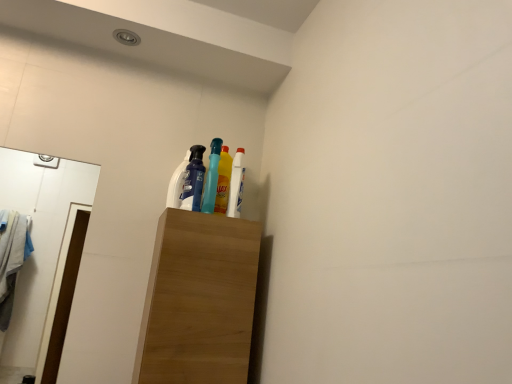
What do you see at coordinates (177, 184) in the screenshot? This screenshot has width=512, height=384. I see `matte white bottle at upper center, which appears as the 2th cleaning product when viewed from the front` at bounding box center [177, 184].

Where is `wooden cabinet at center`? This screenshot has height=384, width=512. wooden cabinet at center is located at coordinates (199, 300).

Is point (212, 142) in front of point (185, 206)?

That is False.

Considering the relative sizes of translucent blue bottle at center, placed as the first bottle when sorted from left to right, and translucent blue bottle at center, acting as the first cleaning product starting from the front, in the image provided, is translucent blue bottle at center, placed as the first bottle when sorted from left to right, wider than translucent blue bottle at center, acting as the first cleaning product starting from the front,?

Correct, the width of translucent blue bottle at center, placed as the first bottle when sorted from left to right, exceeds that of translucent blue bottle at center, acting as the first cleaning product starting from the front.

Is translucent blue bottle at center, which is counted as the second bottle, starting from the right, far from translucent blue bottle at center, the 2th cleaning product positioned from the back?

No, there isn't a large distance between translucent blue bottle at center, which is counted as the second bottle, starting from the right, and translucent blue bottle at center, the 2th cleaning product positioned from the back.

You are a GUI agent. You are given a task and a screenshot of the screen. Output one action in this format:
    pyautogui.click(x=<x>, y=<y>)
    Task: Click on the 1st bottle to the right when counting from the translucent blue bottle at center, acting as the first cleaning product starting from the front
    
    Given the screenshot: What is the action you would take?
    pyautogui.click(x=212, y=177)

Identify the location of cleaning product lying below the translucent blue bottle at center, acting as the first cleaning product starting from the front (from the image's perspective). Image resolution: width=512 pixels, height=384 pixels. 177,184.

Who is more distant, matte white bottle at upper center, which appears as the 2th cleaning product when viewed from the front, or translucent blue bottle at center, acting as the first cleaning product starting from the front?

matte white bottle at upper center, which appears as the 2th cleaning product when viewed from the front, is further from the camera.

From a real-world perspective, is matte white bottle at upper center, which appears as the 2th cleaning product when viewed from the front, on top of translucent blue bottle at center, acting as the first cleaning product starting from the front?

No, from a real-world perspective, matte white bottle at upper center, which appears as the 2th cleaning product when viewed from the front, is not on top of translucent blue bottle at center, acting as the first cleaning product starting from the front.

Is white glossy mirror at left aimed at yellow glossy bottle at upper center, which is the first bottle in right-to-left order?

No, white glossy mirror at left is not aimed at yellow glossy bottle at upper center, which is the first bottle in right-to-left order.

What's the angular difference between white glossy mirror at left and yellow glossy bottle at upper center, which is the first bottle in right-to-left order,'s facing directions?

There is a 2.58-degree angle between the facing directions of white glossy mirror at left and yellow glossy bottle at upper center, which is the first bottle in right-to-left order.

In the image, is white glossy mirror at left positioned in front of or behind yellow glossy bottle at upper center, positioned as the 2th bottle in left-to-right order?

white glossy mirror at left is positioned closer to the viewer than yellow glossy bottle at upper center, positioned as the 2th bottle in left-to-right order.

From a real-world perspective, is white glossy mirror at left on top of yellow glossy bottle at upper center, positioned as the 2th bottle in left-to-right order?

No, from a real-world perspective, white glossy mirror at left is not over yellow glossy bottle at upper center, positioned as the 2th bottle in left-to-right order

What's the angular difference between yellow glossy bottle at upper center, positioned as the 2th bottle in left-to-right order, and wooden cabinet at center's facing directions?

There is a 0.219-degree angle between the facing directions of yellow glossy bottle at upper center, positioned as the 2th bottle in left-to-right order, and wooden cabinet at center.

Which object is thinner, yellow glossy bottle at upper center, positioned as the 2th bottle in left-to-right order, or wooden cabinet at center?

yellow glossy bottle at upper center, positioned as the 2th bottle in left-to-right order, is thinner.

Considering the positions of points (244, 176) and (167, 280), is point (244, 176) farther from camera compared to point (167, 280)?

Yes, it is.

From the image's perspective, is yellow glossy bottle at upper center, which is the first bottle in right-to-left order, on top of wooden cabinet at center?

Yes, from the image's perspective, yellow glossy bottle at upper center, which is the first bottle in right-to-left order, is on top of wooden cabinet at center.

From a real-world perspective, which is physically below, matte white bottle at upper center, which appears as the 2th cleaning product when viewed from the front, or wooden cabinet at center?

In real-world perspective, wooden cabinet at center is lower.

Would you say wooden cabinet at center is part of matte white bottle at upper center, marked as the first cleaning product in a back-to-front arrangement,'s contents?

No, wooden cabinet at center is not surrounded by matte white bottle at upper center, marked as the first cleaning product in a back-to-front arrangement.

This screenshot has height=384, width=512. Find the location of `the 1st cleaning product above the wooden cabinet at center (from a real-world perspective)`. the 1st cleaning product above the wooden cabinet at center (from a real-world perspective) is located at coordinates (177, 184).

Does white glossy mirror at left have a greater height compared to matte white bottle at upper center, which appears as the 2th cleaning product when viewed from the front?

Indeed, white glossy mirror at left has a greater height compared to matte white bottle at upper center, which appears as the 2th cleaning product when viewed from the front.

Where is `mirror on the left side of matte white bottle at upper center, which appears as the 2th cleaning product when viewed from the front`? mirror on the left side of matte white bottle at upper center, which appears as the 2th cleaning product when viewed from the front is located at coordinates (38, 242).

How far apart are white glossy mirror at left and matte white bottle at upper center, which appears as the 2th cleaning product when viewed from the front?

white glossy mirror at left is 1.54 meters from matte white bottle at upper center, which appears as the 2th cleaning product when viewed from the front.

Based on the photo, does white glossy mirror at left appear on the right side of matte white bottle at upper center, which appears as the 2th cleaning product when viewed from the front?

In fact, white glossy mirror at left is to the left of matte white bottle at upper center, which appears as the 2th cleaning product when viewed from the front.

Which of these two, yellow glossy bottle at upper center, positioned as the 2th bottle in left-to-right order, or translucent blue bottle at center, which is counted as the second bottle, starting from the right, is smaller?

yellow glossy bottle at upper center, positioned as the 2th bottle in left-to-right order, is smaller.

Which is in front, yellow glossy bottle at upper center, positioned as the 2th bottle in left-to-right order, or translucent blue bottle at center, placed as the first bottle when sorted from left to right?

Positioned in front is translucent blue bottle at center, placed as the first bottle when sorted from left to right.

Is yellow glossy bottle at upper center, which is the first bottle in right-to-left order, completely or partially outside of translucent blue bottle at center, placed as the first bottle when sorted from left to right?

Yes.

From a real-world perspective, who is located lower, yellow glossy bottle at upper center, positioned as the 2th bottle in left-to-right order, or translucent blue bottle at center, which is counted as the second bottle, starting from the right?

translucent blue bottle at center, which is counted as the second bottle, starting from the right, is physically lower.

The height and width of the screenshot is (384, 512). I want to click on the 1st bottle positioned below the translucent blue bottle at center, the 2th cleaning product positioned from the back (from the image's perspective), so click(212, 177).

Where is `cleaning product lying on the right of matte white bottle at upper center, marked as the first cleaning product in a back-to-front arrangement`? The height and width of the screenshot is (384, 512). cleaning product lying on the right of matte white bottle at upper center, marked as the first cleaning product in a back-to-front arrangement is located at coordinates (194, 180).

When comparing their distances from matte white bottle at upper center, marked as the first cleaning product in a back-to-front arrangement, does white glossy mirror at left or translucent blue bottle at center, acting as the first cleaning product starting from the front, seem closer?

translucent blue bottle at center, acting as the first cleaning product starting from the front, is positioned closer to the anchor matte white bottle at upper center, marked as the first cleaning product in a back-to-front arrangement.

From the image, which object appears to be nearer to matte white bottle at upper center, which appears as the 2th cleaning product when viewed from the front, yellow glossy bottle at upper center, positioned as the 2th bottle in left-to-right order, or wooden cabinet at center?

The object closer to matte white bottle at upper center, which appears as the 2th cleaning product when viewed from the front, is yellow glossy bottle at upper center, positioned as the 2th bottle in left-to-right order.

Considering their positions, is matte white bottle at upper center, marked as the first cleaning product in a back-to-front arrangement, positioned closer to wooden cabinet at center than white glossy mirror at left?

matte white bottle at upper center, marked as the first cleaning product in a back-to-front arrangement, lies closer to wooden cabinet at center than the other object.

When comparing their distances from translucent blue bottle at center, placed as the first bottle when sorted from left to right, does translucent blue bottle at center, the 2th cleaning product positioned from the back, or matte white bottle at upper center, which appears as the 2th cleaning product when viewed from the front, seem further?

matte white bottle at upper center, which appears as the 2th cleaning product when viewed from the front, is further to translucent blue bottle at center, placed as the first bottle when sorted from left to right.

From the image, which object appears to be nearer to matte white bottle at upper center, which appears as the 2th cleaning product when viewed from the front, translucent blue bottle at center, which is counted as the second bottle, starting from the right, or wooden cabinet at center?

translucent blue bottle at center, which is counted as the second bottle, starting from the right, lies closer to matte white bottle at upper center, which appears as the 2th cleaning product when viewed from the front, than the other object.

Estimate the real-world distances between objects in this image. Which object is further from translucent blue bottle at center, the 2th cleaning product positioned from the back, wooden cabinet at center or white glossy mirror at left?

white glossy mirror at left lies further to translucent blue bottle at center, the 2th cleaning product positioned from the back, than the other object.

From the image, which object appears to be farther from matte white bottle at upper center, which appears as the 2th cleaning product when viewed from the front, wooden cabinet at center or translucent blue bottle at center, placed as the first bottle when sorted from left to right?

wooden cabinet at center is positioned further to the anchor matte white bottle at upper center, which appears as the 2th cleaning product when viewed from the front.

Looking at the image, which one is located further to white glossy mirror at left, wooden cabinet at center or yellow glossy bottle at upper center, which is the first bottle in right-to-left order?

wooden cabinet at center is further to white glossy mirror at left.

Identify the location of cleaning product situated between white glossy mirror at left and translucent blue bottle at center, acting as the first cleaning product starting from the front, from left to right. The width and height of the screenshot is (512, 384). (177, 184).

Identify the location of bottle located between white glossy mirror at left and yellow glossy bottle at upper center, which is the first bottle in right-to-left order, in the left-right direction. This screenshot has height=384, width=512. (212, 177).

The image size is (512, 384). What are the coordinates of `cleaning product between translucent blue bottle at center, the 2th cleaning product positioned from the back, and wooden cabinet at center vertically` in the screenshot? It's located at (177, 184).

You are a GUI agent. You are given a task and a screenshot of the screen. Output one action in this format:
    pyautogui.click(x=<x>, y=<y>)
    Task: Click on the bottle between matte white bottle at upper center, marked as the first cleaning product in a back-to-front arrangement, and yellow glossy bottle at upper center, which is the first bottle in right-to-left order, in the horizontal direction
    Image resolution: width=512 pixels, height=384 pixels.
    Given the screenshot: What is the action you would take?
    pyautogui.click(x=212, y=177)